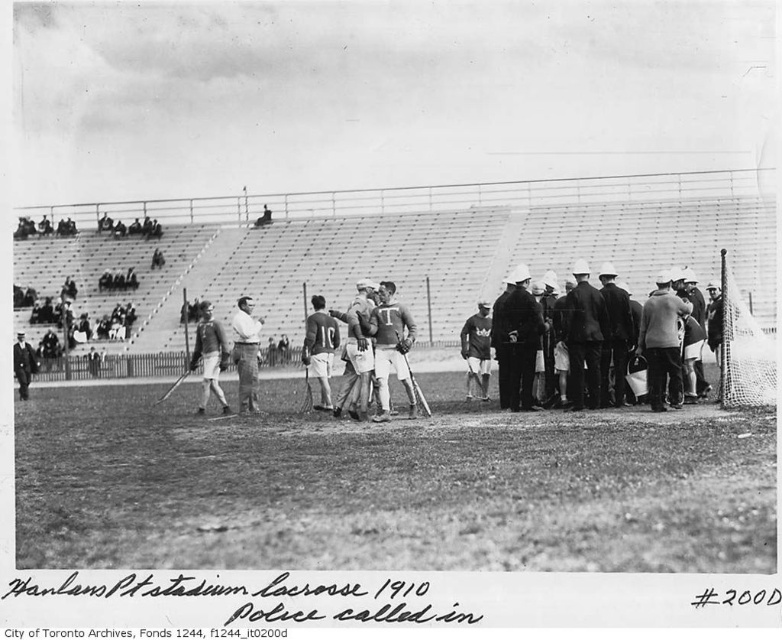
Question: Is matte white uniform at center closer to the viewer compared to smooth leather jacket at center?

Choices:
 (A) yes
 (B) no

Answer: (A)

Question: Can you confirm if matte white jersey at center is wider than smooth black suit at lower left?

Choices:
 (A) no
 (B) yes

Answer: (A)

Question: Which point is closer to the camera taking this photo?

Choices:
 (A) (27, 369)
 (B) (321, 321)
 (C) (242, 304)

Answer: (B)

Question: Which object is positioned farthest from the matte white jersey at center?

Choices:
 (A) matte white uniform at center
 (B) dark wool coat at center
 (C) coarse wool sweater at center

Answer: (C)

Question: Considering the real-world distances, which object is closest to the smooth white shirt at center?

Choices:
 (A) matte white jersey at center
 (B) matte white uniform at center

Answer: (A)

Question: Is matte white uniform at center further to the viewer compared to smooth black suit at lower left?

Choices:
 (A) yes
 (B) no

Answer: (B)